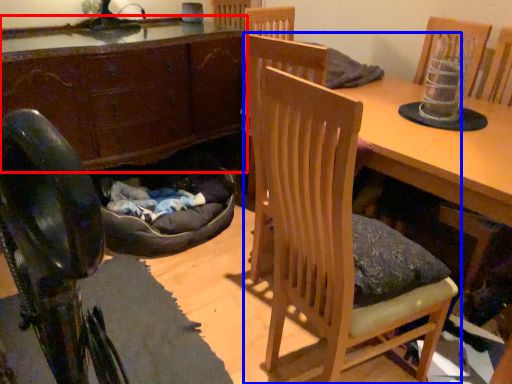
Question: Which object appears closest to the camera in this image, cabinetry (highlighted by a red box) or chair (highlighted by a blue box)?

Choices:
 (A) cabinetry
 (B) chair

Answer: (B)